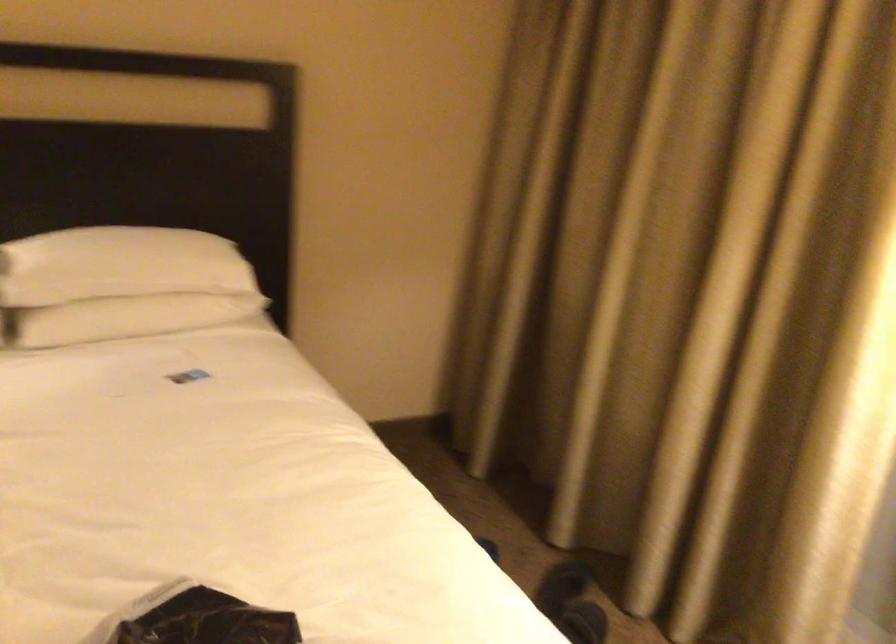
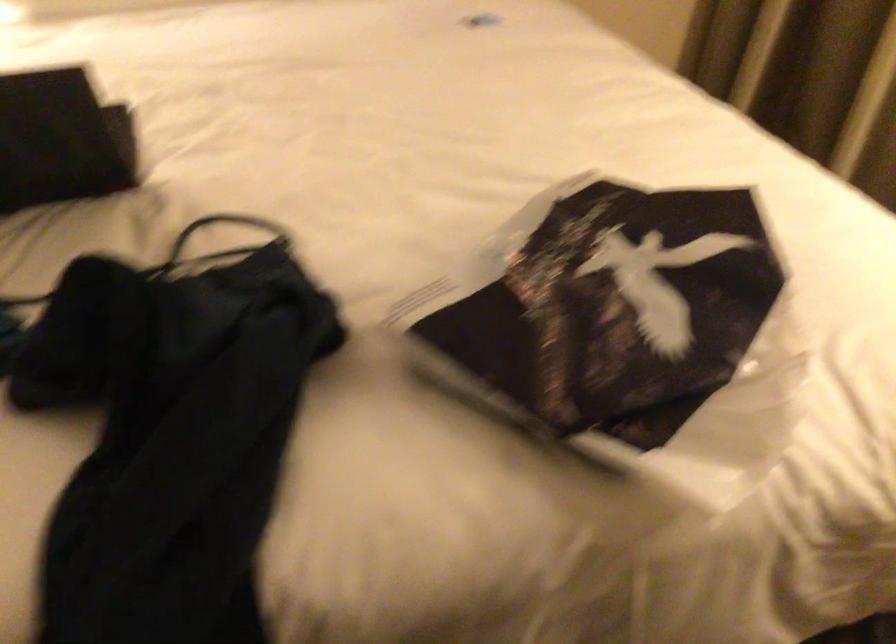
Question: The images are taken continuously from a first-person perspective. In which direction is your viewpoint rotating?

Choices:
 (A) Left
 (B) Right
 (C) Up
 (D) Down

Answer: (D)